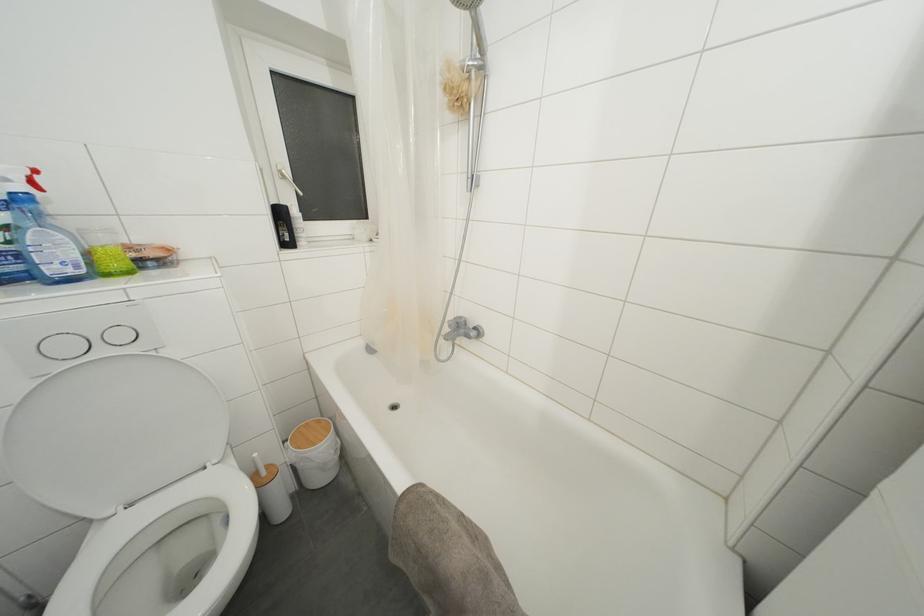
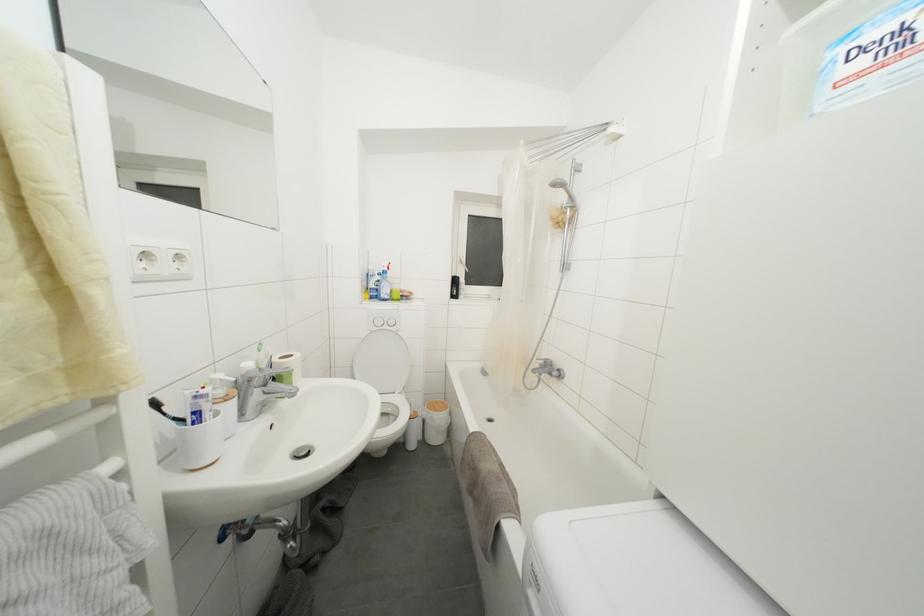
Locate, in the second image, the point that corresponds to (x=106, y=357) in the first image.

(390, 331)